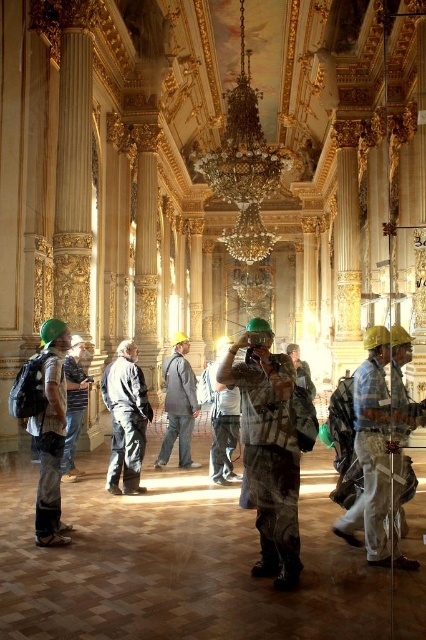
Question: From the image, what is the correct spatial relationship of matte green helmet at left in relation to dark gray fabric jacket at center?

Choices:
 (A) above
 (B) below

Answer: (B)

Question: Considering the relative positions of camouflage fabric shirt at center and matte green helmet at left in the image provided, where is camouflage fabric shirt at center located with respect to matte green helmet at left?

Choices:
 (A) below
 (B) above

Answer: (A)

Question: Which object is closer to the camera taking this photo?

Choices:
 (A) gray fabric jacket at center
 (B) camouflage shirt at center
 (C) camouflage-patterned shirt at center

Answer: (B)

Question: Estimate the real-world distances between objects in this image. Which object is farther from the camouflage shirt at center?

Choices:
 (A) striped shirt at center
 (B) camouflage fabric shirt at center

Answer: (A)

Question: Which object is positioned farthest from the gray fabric jacket at center?

Choices:
 (A) striped shirt at center
 (B) camouflage shirt at center
 (C) matte green helmet at left
 (D) camouflage fabric shirt at center

Answer: (B)

Question: Does matte green helmet at left come behind camouflage-patterned shirt at center?

Choices:
 (A) yes
 (B) no

Answer: (B)